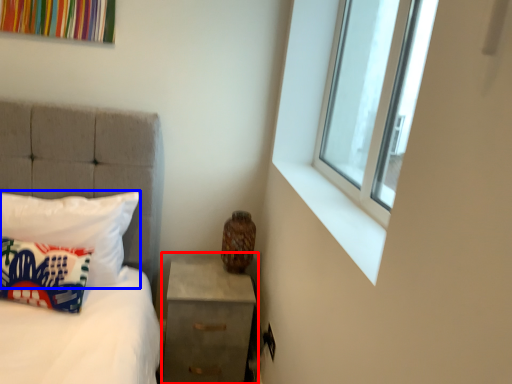
Question: Which object is further to the camera taking this photo, nightstand (highlighted by a red box) or pillow (highlighted by a blue box)?

Choices:
 (A) nightstand
 (B) pillow

Answer: (A)